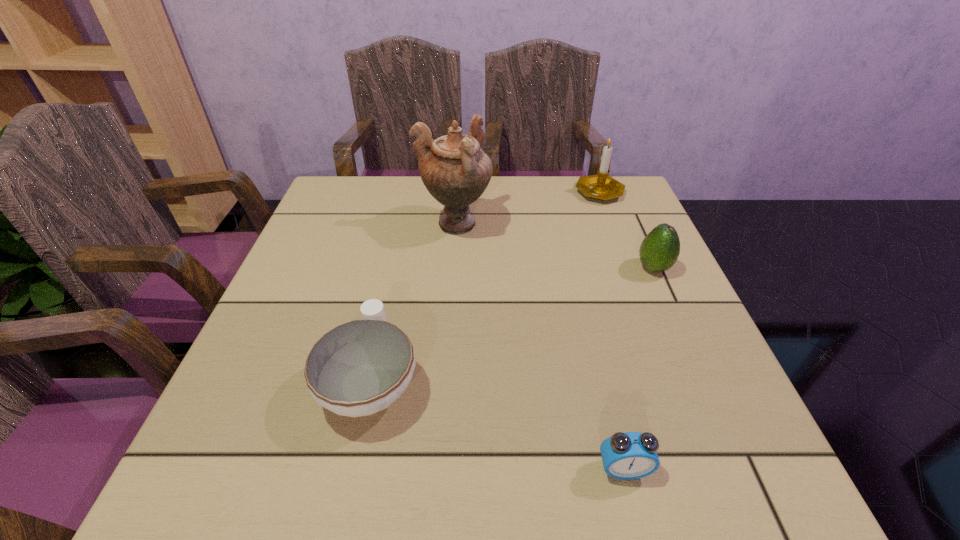
Locate an element on the screen. Image resolution: width=960 pixels, height=540 pixels. vacant space located 0.190m on the side with the handle of the fourth farthest object is located at coordinates (396, 269).

Locate an element on the screen. Image resolution: width=960 pixels, height=540 pixels. vacant space situated on the side with the handle of the fourth farthest object is located at coordinates (395, 275).

Locate an element on the screen. Image resolution: width=960 pixels, height=540 pixels. vacant space located 0.150m on the side with the handle of the fourth farthest object is located at coordinates coord(393,281).

Locate an element on the screen. The image size is (960, 540). urn that is at the far edge is located at coordinates (455, 170).

Where is `candle holder located at the far edge`? The height and width of the screenshot is (540, 960). candle holder located at the far edge is located at coordinates (601, 186).

Find the location of `object that is at the near edge`. object that is at the near edge is located at coordinates (625, 455).

This screenshot has width=960, height=540. I want to click on object positioned at the left edge, so click(x=359, y=368).

Find the location of `candle holder situated at the right edge`. candle holder situated at the right edge is located at coordinates (601, 186).

This screenshot has width=960, height=540. I want to click on avocado that is at the right edge, so click(659, 250).

Identify the location of object that is at the far right corner. (601, 186).